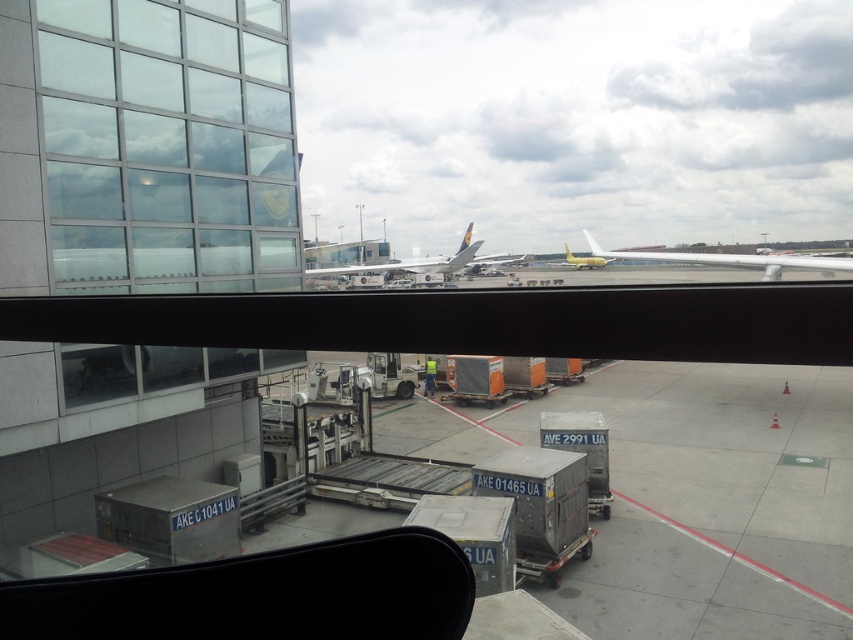
Measure the distance from yellow matte airplane at center to white glossy airplane at center.

They are 15.44 meters apart.

What do you see at coordinates (730, 259) in the screenshot? The width and height of the screenshot is (853, 640). I see `yellow matte airplane at center` at bounding box center [730, 259].

Which is in front, point (680, 256) or point (372, 266)?

Point (680, 256) is in front.

Find the location of a particular element. yellow matte airplane at center is located at coordinates (730, 259).

Who is shorter, transparent glass window at upper left or gold metallic airplane at center?

transparent glass window at upper left

Is point (173, 216) farther from camera compared to point (573, 266)?

No, (173, 216) is closer to viewer.

Image resolution: width=853 pixels, height=640 pixels. I want to click on transparent glass window at upper left, so click(x=167, y=145).

Is yellow matte airplane at center above gold metallic airplane at center?

Incorrect, yellow matte airplane at center is not positioned above gold metallic airplane at center.

Is point (735, 259) positioned behind point (581, 266)?

No.

Between point (735, 256) and point (606, 259), which one is positioned in front?

Positioned in front is point (735, 256).

Locate an element on the screen. The width and height of the screenshot is (853, 640). yellow matte airplane at center is located at coordinates (730, 259).